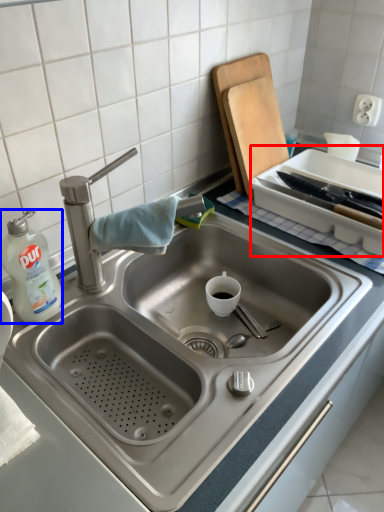
Question: Among these objects, which one is nearest to the camera, appliance (highlighted by a red box) or cleaning product (highlighted by a blue box)?

Choices:
 (A) appliance
 (B) cleaning product

Answer: (B)